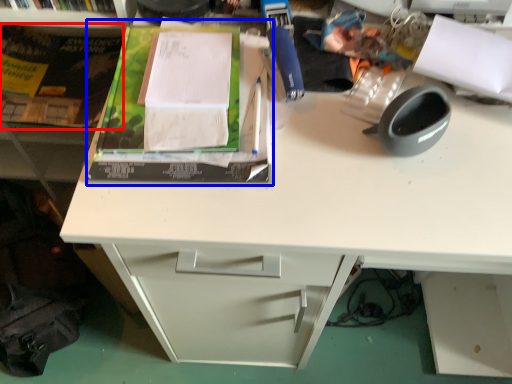
Question: Which of the following is the farthest to the observer, paperback book (highlighted by a red box) or paperback book (highlighted by a blue box)?

Choices:
 (A) paperback book
 (B) paperback book

Answer: (A)